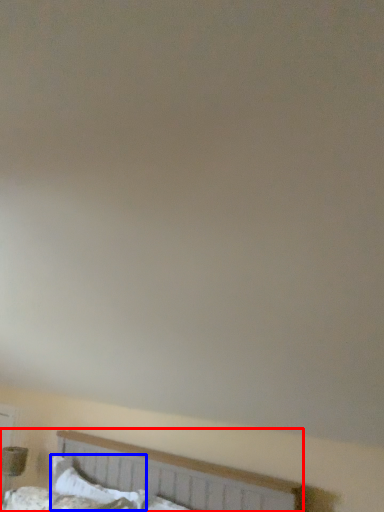
Question: Which object appears farthest to the camera in this image, bed (highlighted by a red box) or pillow (highlighted by a blue box)?

Choices:
 (A) bed
 (B) pillow

Answer: (B)